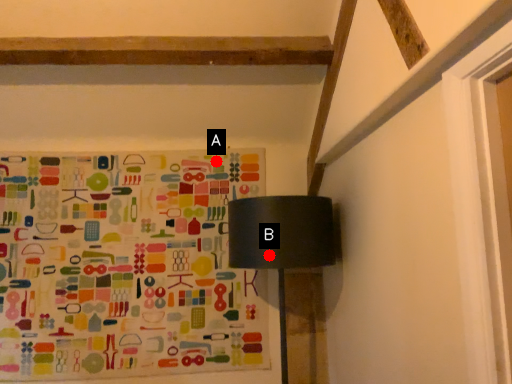
Question: Two points are circled on the image, labeled by A and B beside each circle. Which point appears farthest from the camera in this image?

Choices:
 (A) A is further
 (B) B is further

Answer: (A)